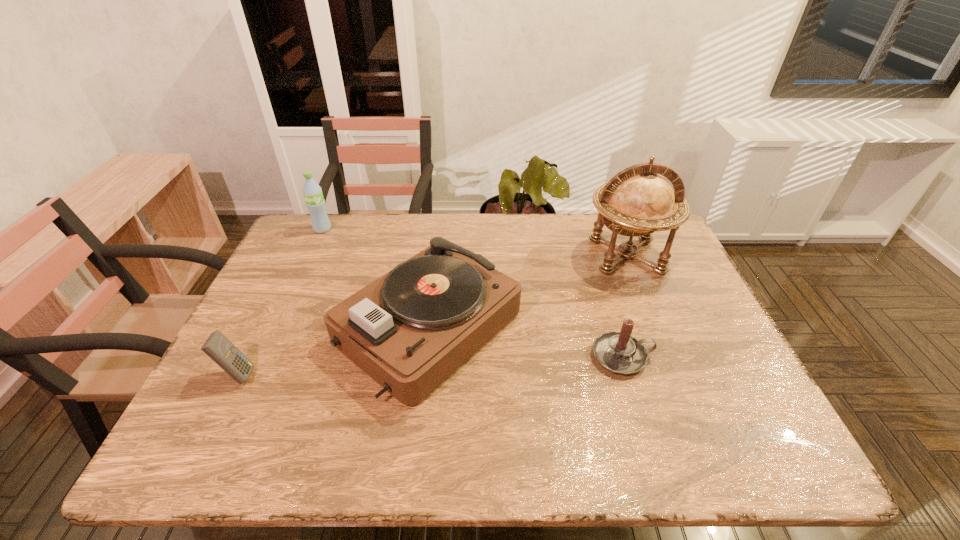
Locate an element on the screen. Image resolution: width=960 pixels, height=540 pixels. globe is located at coordinates (637, 201).

At what (x,y) coordinates should I click in order to perform the action: click on water bottle. Please return your answer as a coordinate pair (x, y). This screenshot has width=960, height=540. Looking at the image, I should click on pyautogui.click(x=312, y=192).

Image resolution: width=960 pixels, height=540 pixels. Find the location of `record player`. record player is located at coordinates (409, 330).

This screenshot has height=540, width=960. Find the location of `candle`. candle is located at coordinates (618, 352).

Identify the location of calculator. The width and height of the screenshot is (960, 540). (222, 351).

I want to click on free space located on the front-facing side of the globe, so click(687, 408).

Find the location of a particular element. This screenshot has width=960, height=540. vacant position located 0.190m on the right of the fourth shortest object is located at coordinates (390, 229).

What are the coordinates of `free location located 0.100m on the back of the record player` in the screenshot? It's located at (439, 246).

The width and height of the screenshot is (960, 540). What are the coordinates of `vacant point located 0.060m on the side of the candle with the handle loop` in the screenshot? It's located at (678, 356).

Find the location of a particular element. The width and height of the screenshot is (960, 540). vacant area situated 0.100m on the front-facing side of the calculator is located at coordinates (299, 374).